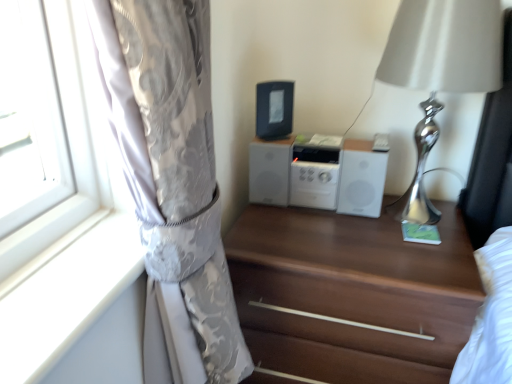
Locate an element on the screen. free space in front of white matte stereo at center is located at coordinates (327, 245).